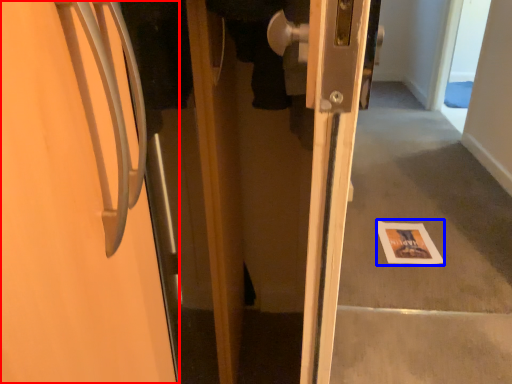
Question: Which object is further to the camera taking this photo, door (highlighted by a red box) or postcard (highlighted by a blue box)?

Choices:
 (A) door
 (B) postcard

Answer: (B)